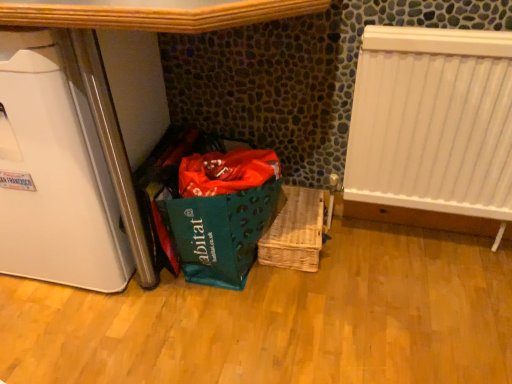
Question: Can you confirm if white glossy refrigerator at left is taller than white plastic radiator at right?

Choices:
 (A) yes
 (B) no

Answer: (A)

Question: Does white glossy refrigerator at left have a smaller size compared to white plastic radiator at right?

Choices:
 (A) no
 (B) yes

Answer: (A)

Question: Does white glossy refrigerator at left lie behind white plastic radiator at right?

Choices:
 (A) yes
 (B) no

Answer: (B)

Question: Is white plastic radiator at right inside white glossy refrigerator at left?

Choices:
 (A) no
 (B) yes

Answer: (A)

Question: Does white glossy refrigerator at left have a greater width compared to white plastic radiator at right?

Choices:
 (A) no
 (B) yes

Answer: (B)

Question: Is white glossy refrigerator at left positioned in front of white plastic radiator at right?

Choices:
 (A) no
 (B) yes

Answer: (B)

Question: Are white glossy refrigerator at left and woven wood basket at center making contact?

Choices:
 (A) no
 (B) yes

Answer: (A)

Question: Is white glossy refrigerator at left surrounding woven wood basket at center?

Choices:
 (A) yes
 (B) no

Answer: (B)

Question: From a real-world perspective, does white glossy refrigerator at left stand above woven wood basket at center?

Choices:
 (A) yes
 (B) no

Answer: (A)

Question: From a real-world perspective, is white glossy refrigerator at left positioned under woven wood basket at center based on gravity?

Choices:
 (A) yes
 (B) no

Answer: (B)

Question: Is white glossy refrigerator at left bigger than woven wood basket at center?

Choices:
 (A) no
 (B) yes

Answer: (B)

Question: From the image's perspective, is white glossy refrigerator at left under woven wood basket at center?

Choices:
 (A) yes
 (B) no

Answer: (B)

Question: Is woven wood basket at center not inside white plastic radiator at right?

Choices:
 (A) yes
 (B) no

Answer: (A)